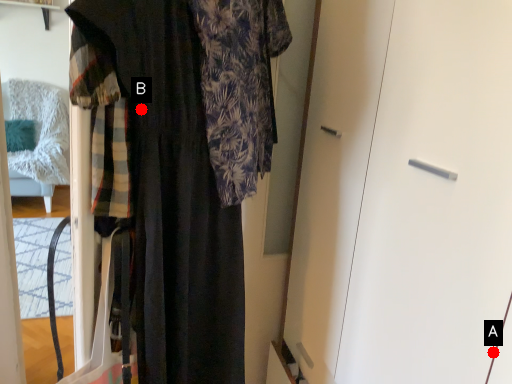
Question: Two points are circled on the image, labeled by A and B beside each circle. Which point is closer to the camera?

Choices:
 (A) A is closer
 (B) B is closer

Answer: (A)